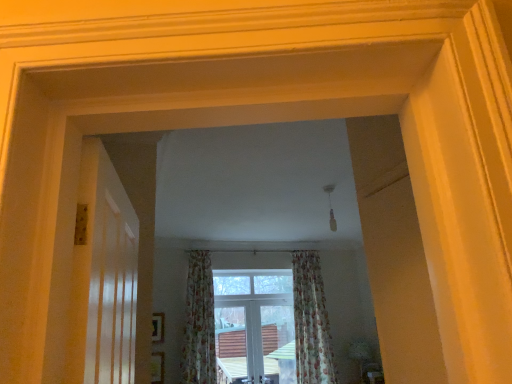
Question: Is floral fabric curtain at center, which is counted as the second curtain, starting from the left, not close to clear glass window at center?

Choices:
 (A) yes
 (B) no

Answer: (B)

Question: Is floral fabric curtain at center, which is counted as the second curtain, starting from the left, shorter than clear glass window at center?

Choices:
 (A) yes
 (B) no

Answer: (B)

Question: Is floral fabric curtain at center, which is counted as the second curtain, starting from the left, at the right side of clear glass window at center?

Choices:
 (A) yes
 (B) no

Answer: (A)

Question: Would you say clear glass window at center is part of floral fabric curtain at center, which is counted as the second curtain, starting from the left,'s contents?

Choices:
 (A) yes
 (B) no

Answer: (B)

Question: Is floral fabric curtain at center, which is counted as the first curtain, starting from the right, smaller than clear glass window at center?

Choices:
 (A) no
 (B) yes

Answer: (A)

Question: From the image's perspective, would you say floral fabric curtain at center, which is counted as the first curtain, starting from the right, is shown under clear glass window at center?

Choices:
 (A) no
 (B) yes

Answer: (A)

Question: Does clear glass window at center appear on the left side of floral fabric curtain at center, arranged as the second curtain when viewed from the right?

Choices:
 (A) yes
 (B) no

Answer: (B)

Question: Is clear glass window at center further to the viewer compared to floral fabric curtain at center, the first curtain positioned from the left?

Choices:
 (A) yes
 (B) no

Answer: (A)

Question: Is clear glass window at center surrounding floral fabric curtain at center, the first curtain positioned from the left?

Choices:
 (A) yes
 (B) no

Answer: (B)

Question: Is clear glass window at center outside floral fabric curtain at center, arranged as the second curtain when viewed from the right?

Choices:
 (A) yes
 (B) no

Answer: (A)

Question: Considering the relative sizes of clear glass window at center and floral fabric curtain at center, arranged as the second curtain when viewed from the right, in the image provided, is clear glass window at center thinner than floral fabric curtain at center, arranged as the second curtain when viewed from the right,?

Choices:
 (A) yes
 (B) no

Answer: (A)

Question: Is clear glass window at center not close to floral fabric curtain at center, arranged as the second curtain when viewed from the right?

Choices:
 (A) yes
 (B) no

Answer: (B)

Question: Does floral fabric curtain at center, the first curtain positioned from the left, have a smaller size compared to floral fabric curtain at center, which is counted as the first curtain, starting from the right?

Choices:
 (A) yes
 (B) no

Answer: (A)